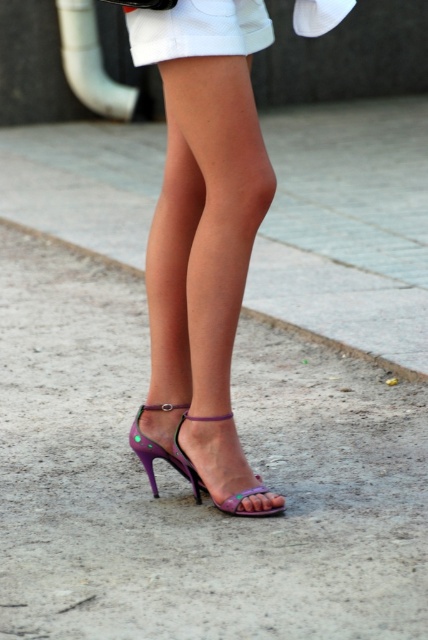
Does purple shiny high-heeled sandals at lower center appear on the left side of purple shiny high-heeled sandal at lower center?

Incorrect, purple shiny high-heeled sandals at lower center is not on the left side of purple shiny high-heeled sandal at lower center.

Is purple shiny high-heeled sandals at lower center below purple shiny high-heeled sandal at lower center?

No.

Does point (181, 45) lie behind point (267, 515)?

No.

Locate an element on the screen. purple shiny high-heeled sandals at lower center is located at coordinates [x=202, y=237].

Is purple shiny high-heeled sandals at lower center below white cotton shorts at center?

Indeed, purple shiny high-heeled sandals at lower center is positioned under white cotton shorts at center.

At what (x,y) coordinates should I click in order to perform the action: click on purple shiny high-heeled sandals at lower center. Please return your answer as a coordinate pair (x, y). Image resolution: width=428 pixels, height=640 pixels. Looking at the image, I should click on (202, 237).

Who is more distant from viewer, (x=240, y=84) or (x=131, y=54)?

Point (x=131, y=54)

Where is `purple shiny high-heeled sandals at lower center`? The width and height of the screenshot is (428, 640). purple shiny high-heeled sandals at lower center is located at coordinates (202, 237).

Measure the distance between white cotton shorts at center and purple shiny high-heeled sandal at lower center.

white cotton shorts at center is 7.58 feet from purple shiny high-heeled sandal at lower center.

Can you confirm if white cotton shorts at center is positioned above purple shiny high-heeled sandal at lower center?

Yes.

The height and width of the screenshot is (640, 428). I want to click on white cotton shorts at center, so click(x=199, y=29).

Where is `white cotton shorts at center`? This screenshot has width=428, height=640. white cotton shorts at center is located at coordinates (199, 29).